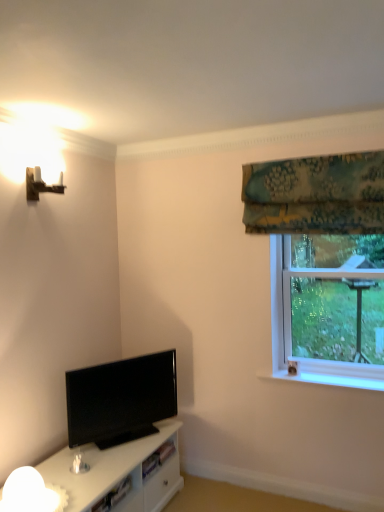
Question: Considering the relative sizes of green floral fabric at upper right and black glossy tv at lower left in the image provided, is green floral fabric at upper right taller than black glossy tv at lower left?

Choices:
 (A) no
 (B) yes

Answer: (B)

Question: Would you say green floral fabric at upper right is outside black glossy tv at lower left?

Choices:
 (A) no
 (B) yes

Answer: (B)

Question: From a real-world perspective, is green floral fabric at upper right beneath black glossy tv at lower left?

Choices:
 (A) no
 (B) yes

Answer: (A)

Question: Considering the relative sizes of green floral fabric at upper right and black glossy tv at lower left in the image provided, is green floral fabric at upper right bigger than black glossy tv at lower left?

Choices:
 (A) no
 (B) yes

Answer: (B)

Question: Is black glossy tv at lower left at the back of green floral fabric at upper right?

Choices:
 (A) no
 (B) yes

Answer: (A)

Question: Is green floral fabric at upper right not close to black glossy tv at lower left?

Choices:
 (A) yes
 (B) no

Answer: (A)

Question: Is wooden wall sconce at upper left not close to green floral fabric at upper right?

Choices:
 (A) no
 (B) yes

Answer: (B)

Question: Can you confirm if wooden wall sconce at upper left is smaller than green floral fabric at upper right?

Choices:
 (A) no
 (B) yes

Answer: (B)

Question: Could you tell me if wooden wall sconce at upper left is facing green floral fabric at upper right?

Choices:
 (A) yes
 (B) no

Answer: (B)

Question: Is wooden wall sconce at upper left completely or partially outside of green floral fabric at upper right?

Choices:
 (A) yes
 (B) no

Answer: (A)

Question: From a real-world perspective, does wooden wall sconce at upper left stand above green floral fabric at upper right?

Choices:
 (A) no
 (B) yes

Answer: (B)

Question: Is green floral fabric at upper right located within wooden wall sconce at upper left?

Choices:
 (A) yes
 (B) no

Answer: (B)

Question: Can you confirm if transparent glass window at upper right is bigger than white frosted glass lamp at lower left?

Choices:
 (A) no
 (B) yes

Answer: (B)